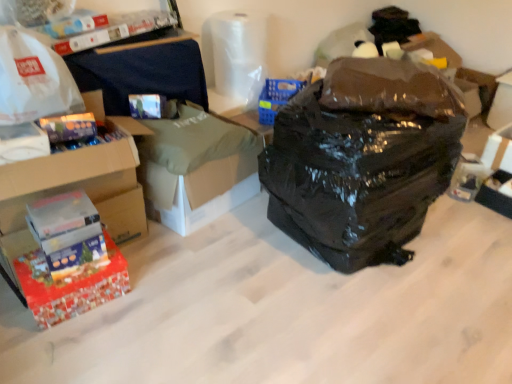
This screenshot has width=512, height=384. I want to click on vacant space in front of red glossy box at lower left, the 1th box from the bottom, so click(x=64, y=346).